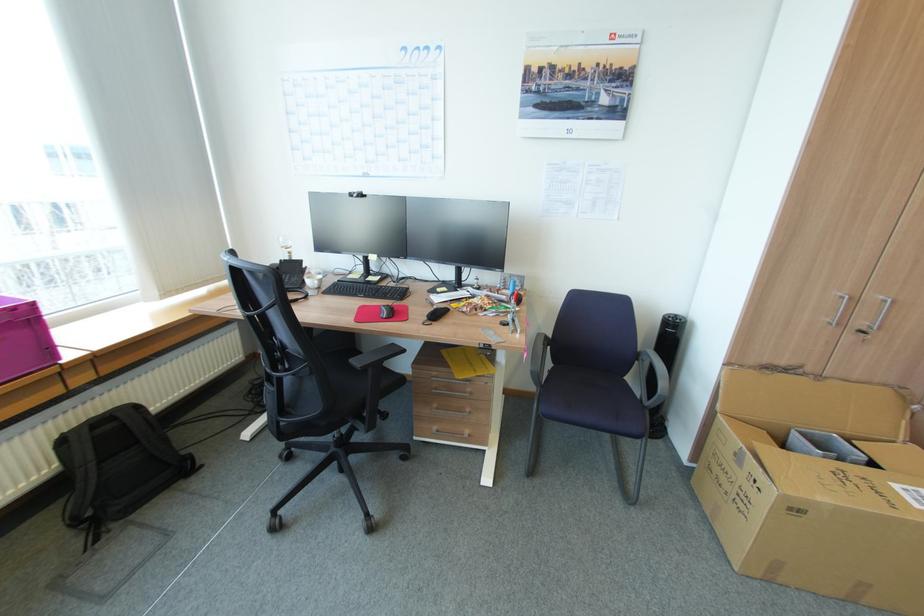
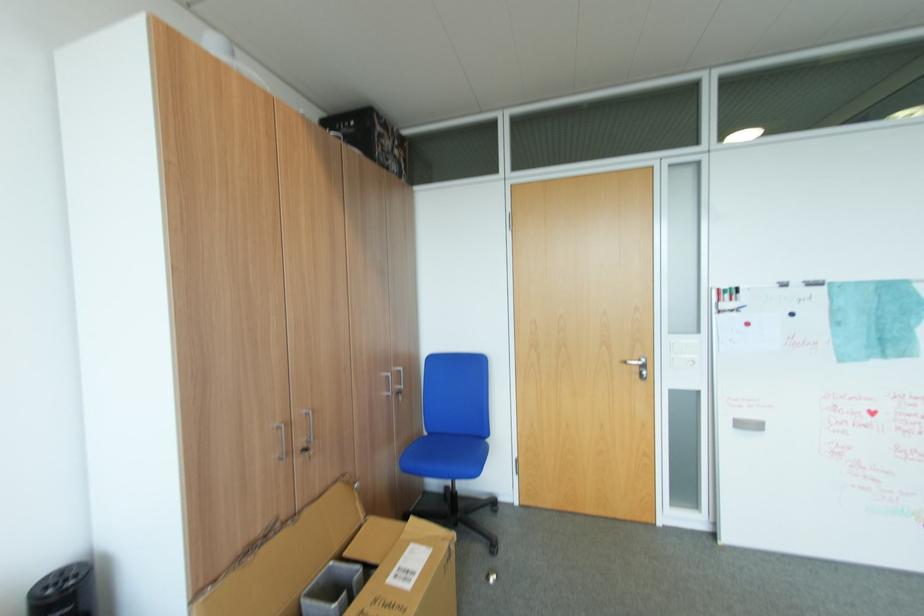
Question: The first image is from the beginning of the video and the second image is from the end. How did the camera likely rotate when shooting the video?

Choices:
 (A) Left
 (B) Right
 (C) Up
 (D) Down

Answer: (B)